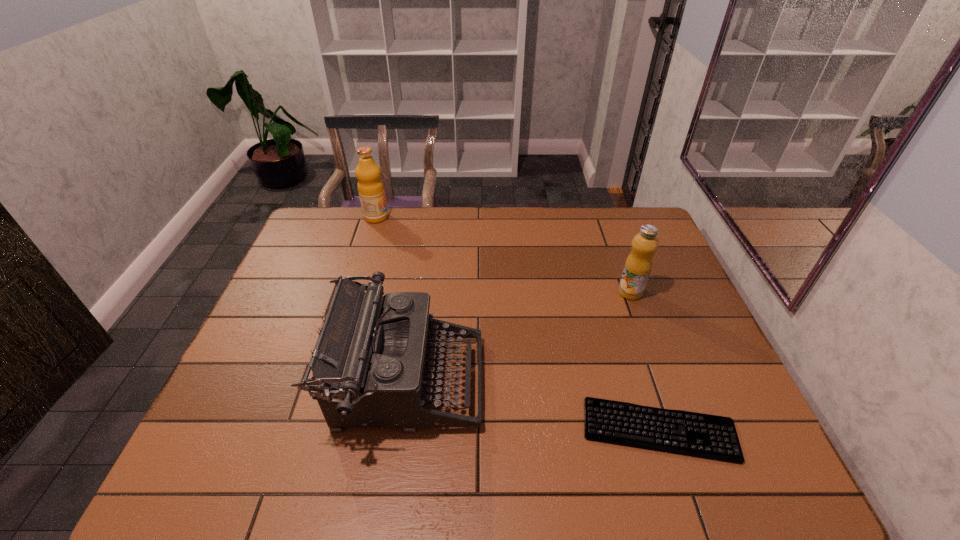
I want to click on object that stands as the closest to the computer keyboard, so click(x=369, y=364).

What are the coordinates of `vacant space that satisfies the following two spatial constraints: 1. on the front label of the farther fruit juice; 2. on the left side of the shortest object` in the screenshot? It's located at (311, 430).

The height and width of the screenshot is (540, 960). What are the coordinates of `blank area in the image that satisfies the following two spatial constraints: 1. on the front label of the second farthest object; 2. on the typing side of the typewriter` in the screenshot? It's located at (663, 382).

You are a GUI agent. You are given a task and a screenshot of the screen. Output one action in this format:
    pyautogui.click(x=<x>, y=<y>)
    Task: Click on the vacant position in the image that satisfies the following two spatial constraints: 1. on the front label of the third nearest object; 2. on the typing side of the typewriter
    This screenshot has width=960, height=540.
    Given the screenshot: What is the action you would take?
    click(x=663, y=382)

Where is `blank area in the image that satisfies the following two spatial constraints: 1. on the front label of the farthest object; 2. on the right side of the computer keyboard`? Image resolution: width=960 pixels, height=540 pixels. blank area in the image that satisfies the following two spatial constraints: 1. on the front label of the farthest object; 2. on the right side of the computer keyboard is located at coordinates click(x=311, y=430).

Where is `blank space that satisfies the following two spatial constraints: 1. on the front label of the shorter fruit juice; 2. on the typing side of the typewriter`? The height and width of the screenshot is (540, 960). blank space that satisfies the following two spatial constraints: 1. on the front label of the shorter fruit juice; 2. on the typing side of the typewriter is located at coordinates (663, 382).